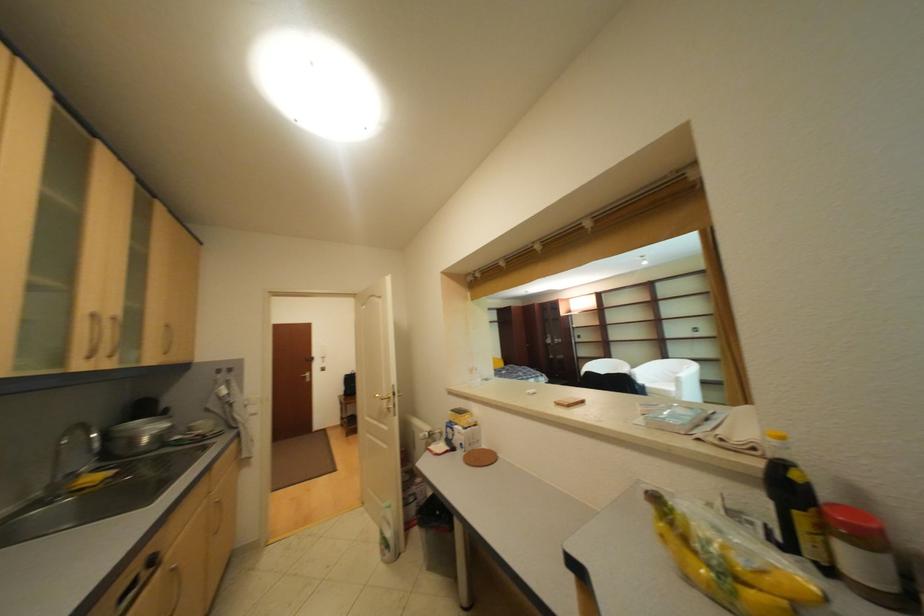
You are a GUI agent. You are given a task and a screenshot of the screen. Output one action in this format:
    pyautogui.click(x=<x>, y=<y>)
    Task: Click on the brown door handle
    The width and height of the screenshot is (924, 616).
    Given the screenshot: What is the action you would take?
    pyautogui.click(x=306, y=378)